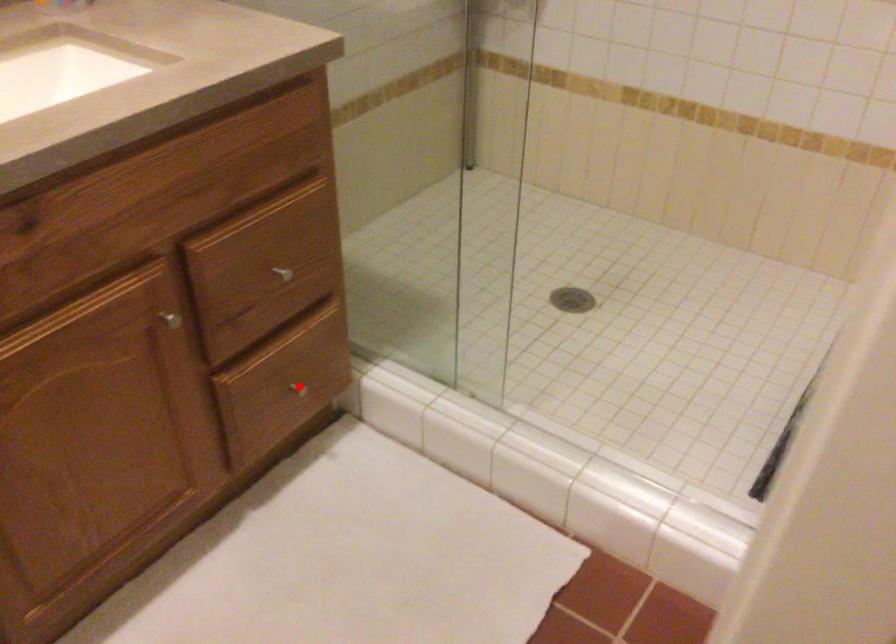
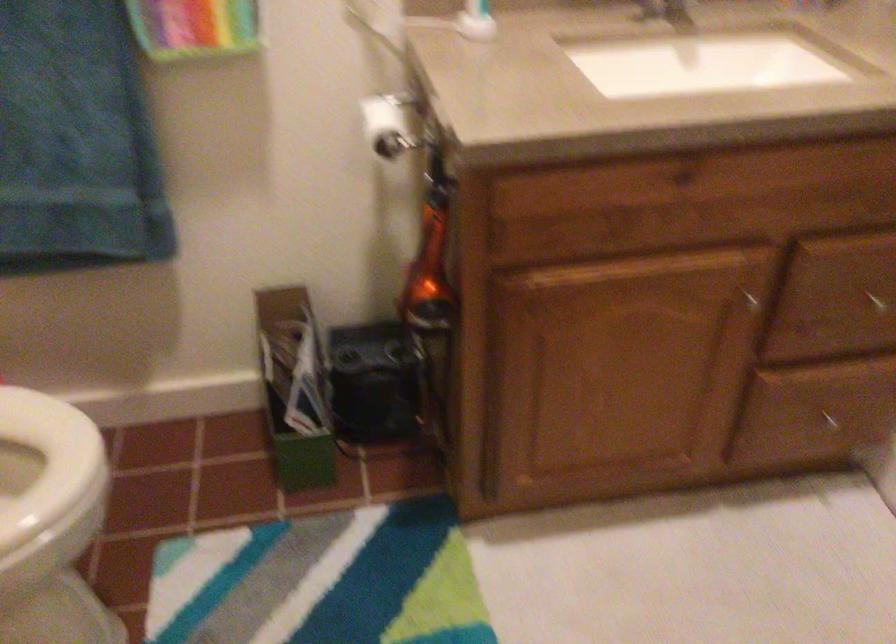
Find the pixel in the second image that matches the highlighted location in the first image.

(831, 422)